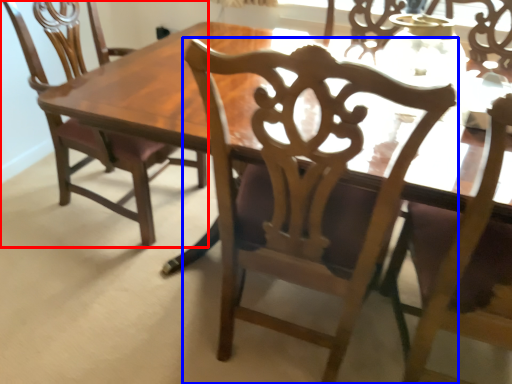
Question: Which object appears farthest to the camera in this image, chair (highlighted by a red box) or chair (highlighted by a blue box)?

Choices:
 (A) chair
 (B) chair

Answer: (A)